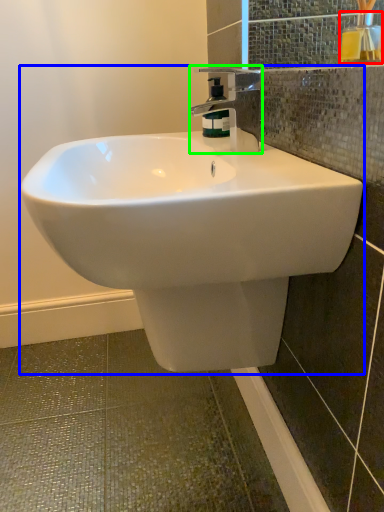
Question: Which object is positioned farthest from mouthwash (highlighted by a red box)? Select from sink (highlighted by a blue box) and tap (highlighted by a green box).

Choices:
 (A) sink
 (B) tap

Answer: (A)